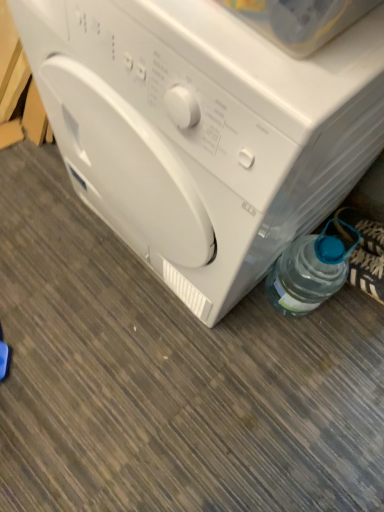
Question: Is white glossy washing machine at center facing away from white plastic washing machine at center?

Choices:
 (A) yes
 (B) no

Answer: (B)

Question: Can you confirm if white glossy washing machine at center is smaller than white plastic washing machine at center?

Choices:
 (A) no
 (B) yes

Answer: (A)

Question: Is white glossy washing machine at center wider than white plastic washing machine at center?

Choices:
 (A) yes
 (B) no

Answer: (B)

Question: Is white glossy washing machine at center beside white plastic washing machine at center?

Choices:
 (A) yes
 (B) no

Answer: (B)

Question: Would you say white glossy washing machine at center is outside white plastic washing machine at center?

Choices:
 (A) no
 (B) yes

Answer: (B)

Question: Is white glossy washing machine at center to the right of white plastic washing machine at center from the viewer's perspective?

Choices:
 (A) no
 (B) yes

Answer: (B)

Question: Could you tell me if clear plastic bottle at lower right is facing white plastic washing machine at center?

Choices:
 (A) no
 (B) yes

Answer: (A)

Question: Is clear plastic bottle at lower right next to white plastic washing machine at center and touching it?

Choices:
 (A) no
 (B) yes

Answer: (A)

Question: Does clear plastic bottle at lower right have a lesser height compared to white plastic washing machine at center?

Choices:
 (A) yes
 (B) no

Answer: (B)

Question: From a real-world perspective, is clear plastic bottle at lower right physically below white plastic washing machine at center?

Choices:
 (A) no
 (B) yes

Answer: (A)

Question: Is clear plastic bottle at lower right not near white plastic washing machine at center?

Choices:
 (A) yes
 (B) no

Answer: (B)

Question: Considering the relative sizes of clear plastic bottle at lower right and white plastic washing machine at center in the image provided, is clear plastic bottle at lower right taller than white plastic washing machine at center?

Choices:
 (A) yes
 (B) no

Answer: (A)

Question: Is white plastic washing machine at center further to camera compared to clear plastic bottle at lower right?

Choices:
 (A) yes
 (B) no

Answer: (B)